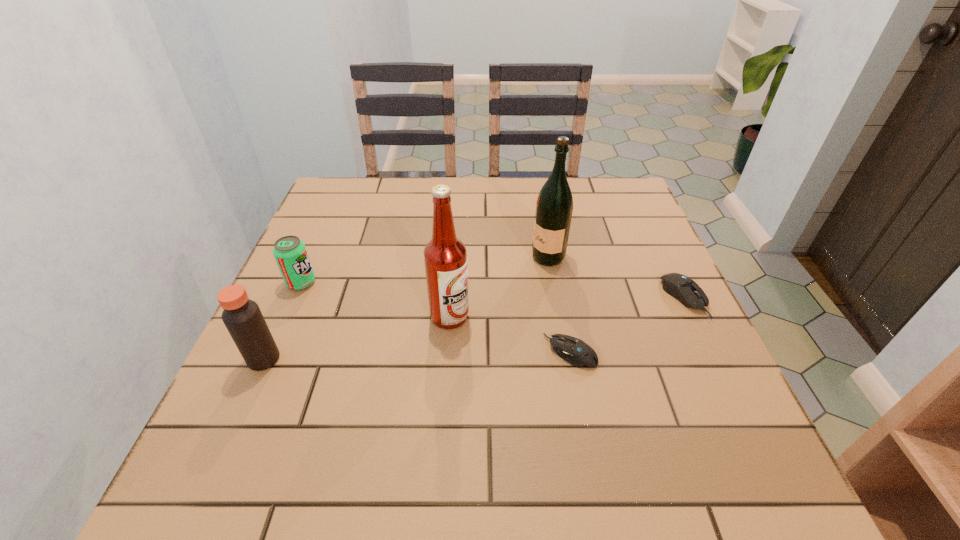
In order to click on vacant region between the pop soda and the alcohol in this screenshot , I will do `click(375, 299)`.

Where is `blank region between the pop soda and the rightmost object`? The height and width of the screenshot is (540, 960). blank region between the pop soda and the rightmost object is located at coordinates (492, 290).

Locate an element on the screen. Image resolution: width=960 pixels, height=540 pixels. unoccupied position between the pop soda and the farther computer mouse is located at coordinates (492, 290).

Image resolution: width=960 pixels, height=540 pixels. I want to click on vacant space that is in between the fourth tallest object and the rightmost object, so click(492, 290).

At what (x,y) coordinates should I click in order to perform the action: click on object identified as the fourth closest to the farthest object. Please return your answer as a coordinate pair (x, y). This screenshot has height=540, width=960. Looking at the image, I should click on (290, 253).

At what (x,y) coordinates should I click in order to perform the action: click on the third closest object to the fourth object from right to left. Please return your answer as a coordinate pair (x, y). Looking at the image, I should click on (290, 253).

You are a GUI agent. You are given a task and a screenshot of the screen. Output one action in this format:
    pyautogui.click(x=<x>, y=<y>)
    Task: Click on the vacant space that satisfies the following two spatial constraints: 1. on the label side of the third object from left to right; 2. on the right side of the shorter computer mouse
    
    Given the screenshot: What is the action you would take?
    pyautogui.click(x=447, y=352)

Where is `vacant space that satisfies the following two spatial constraints: 1. on the front side of the fifth tallest object; 2. on the label side of the third object from left to right`? vacant space that satisfies the following two spatial constraints: 1. on the front side of the fifth tallest object; 2. on the label side of the third object from left to right is located at coordinates click(x=693, y=316).

In order to click on free spot that satisfies the following two spatial constraints: 1. on the back side of the taller computer mouse; 2. on the front-facing side of the liquor in this screenshot , I will do tap(664, 257).